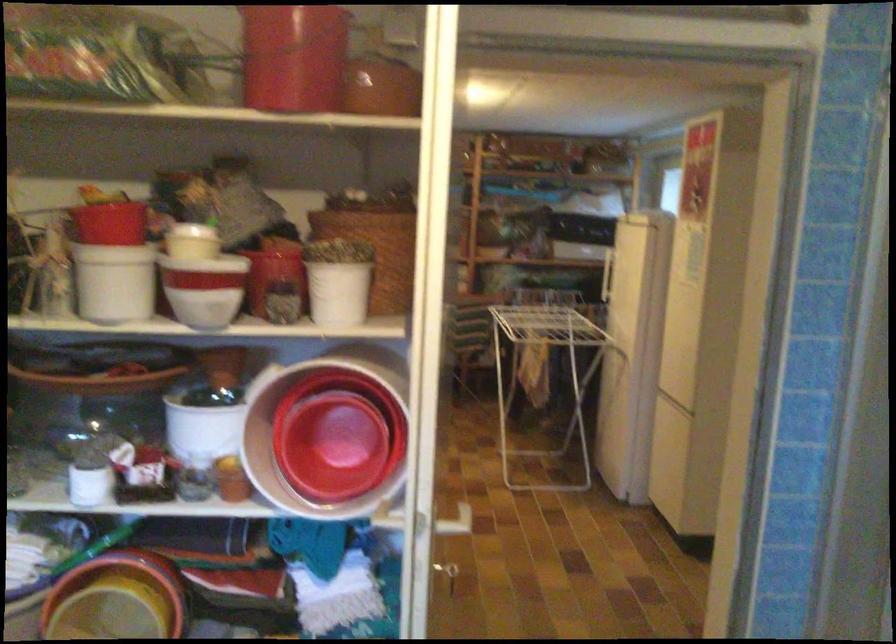
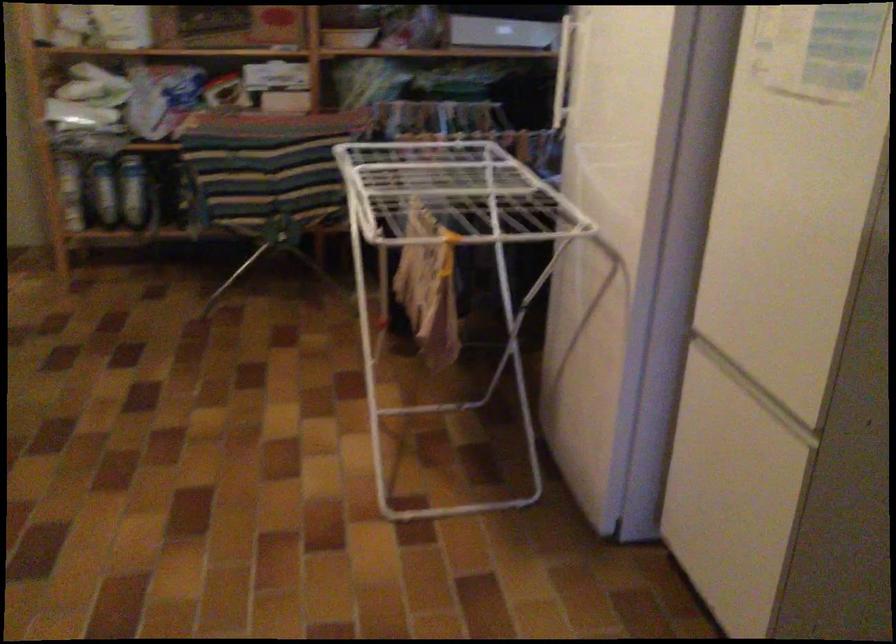
Question: I am providing you with two images of the same scene from different viewpoints. Which of the following objects are not visible in image2?

Choices:
 (A) white drying rack
 (B) freezer door handle
 (C) blue bottle
 (D) round dark coaster

Answer: (A)